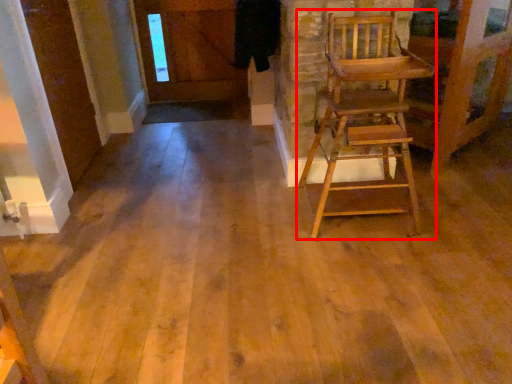
Question: Where is chair (annotated by the red box) located in relation to door in the image?

Choices:
 (A) left
 (B) right

Answer: (B)